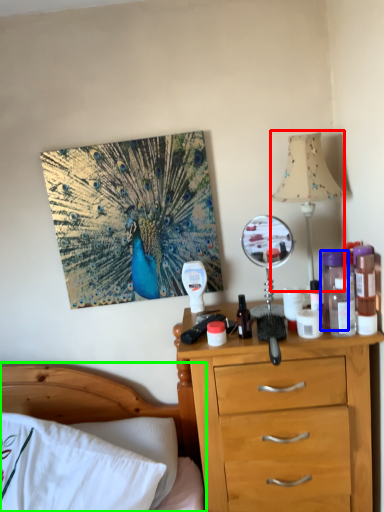
Question: Which object is positioned closest to table lamp (highlighted by a red box)? Select from bottle (highlighted by a blue box) and bed (highlighted by a green box).

Choices:
 (A) bottle
 (B) bed

Answer: (A)